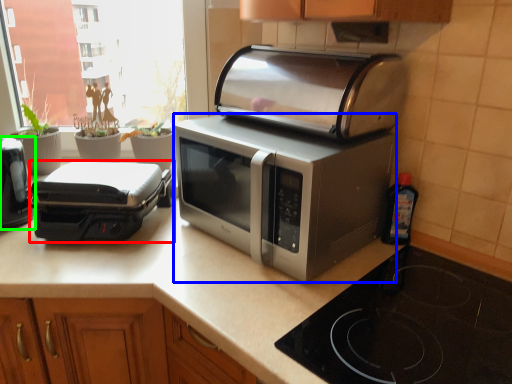
Question: Which object is the closest to the toaster (highlighted by a red box)? Choose among these: microwave oven (highlighted by a blue box) or toaster (highlighted by a green box).

Choices:
 (A) microwave oven
 (B) toaster

Answer: (B)